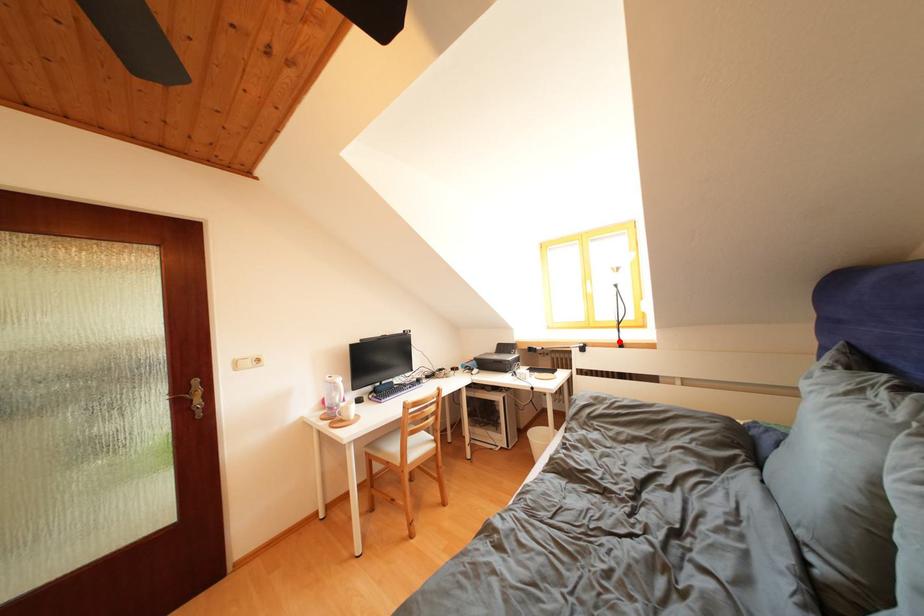
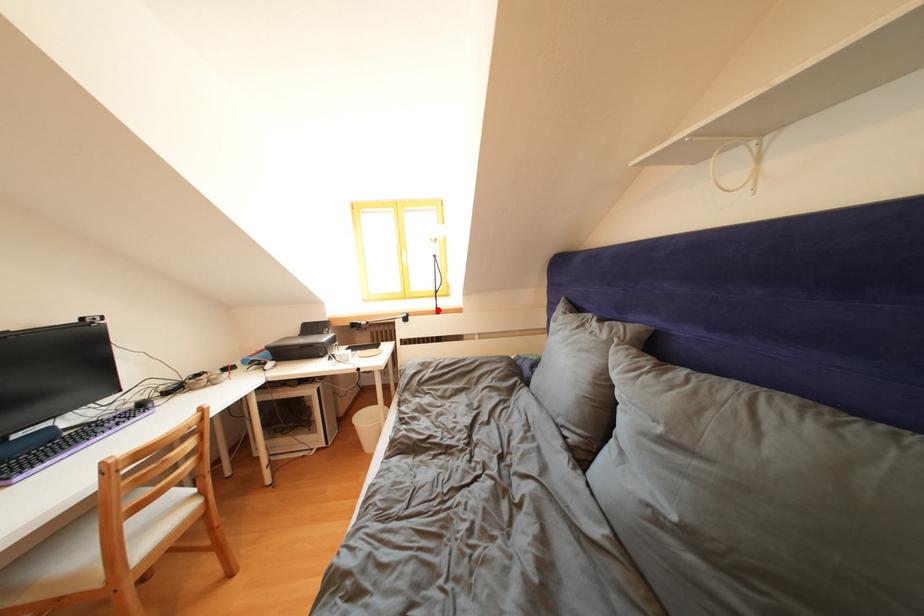
I am providing you with two images of the same scene from different viewpoints. A red point is marked on the first image and another point is marked on the second image. Do the highlighted points in image1 and image2 indicate the same real-world spot?

Yes